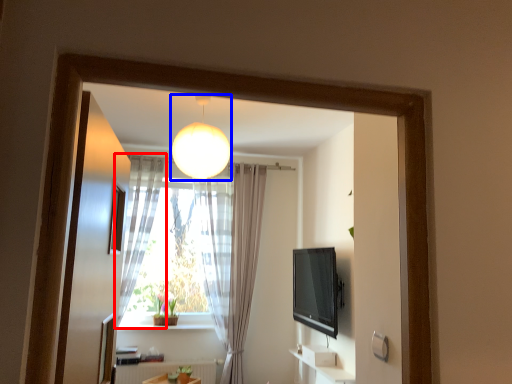
Question: Which object appears closest to the camera in this image, curtain (highlighted by a red box) or lamp (highlighted by a blue box)?

Choices:
 (A) curtain
 (B) lamp

Answer: (B)